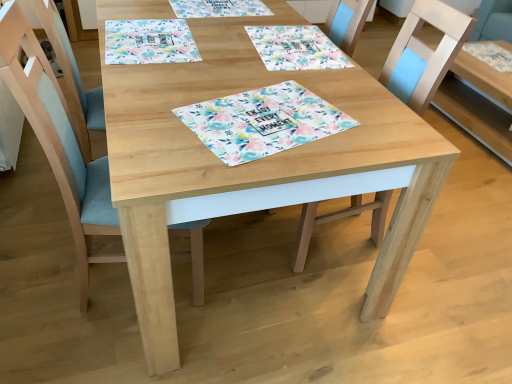
The width and height of the screenshot is (512, 384). In order to click on free spot behind floral paper placemat at center in this screenshot , I will do `click(262, 68)`.